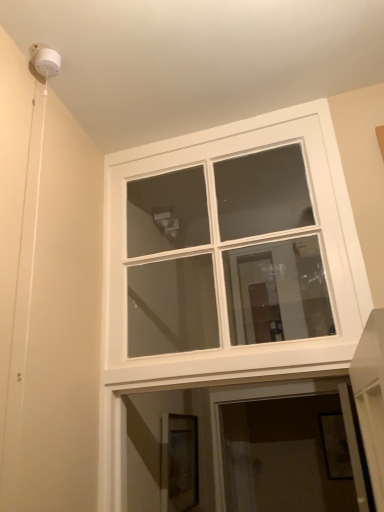
At what (x,y) coordinates should I click in order to perform the action: click on white glossy window at upper center. Please return your answer as a coordinate pair (x, y). This screenshot has height=512, width=384. Looking at the image, I should click on (246, 243).

Measure the distance between point (x=163, y=251) and camera.

They are 7.12 feet apart.

The width and height of the screenshot is (384, 512). What do you see at coordinates (246, 243) in the screenshot?
I see `white glossy window at upper center` at bounding box center [246, 243].

The width and height of the screenshot is (384, 512). What are the coordinates of `white glossy window at upper center` in the screenshot? It's located at (246, 243).